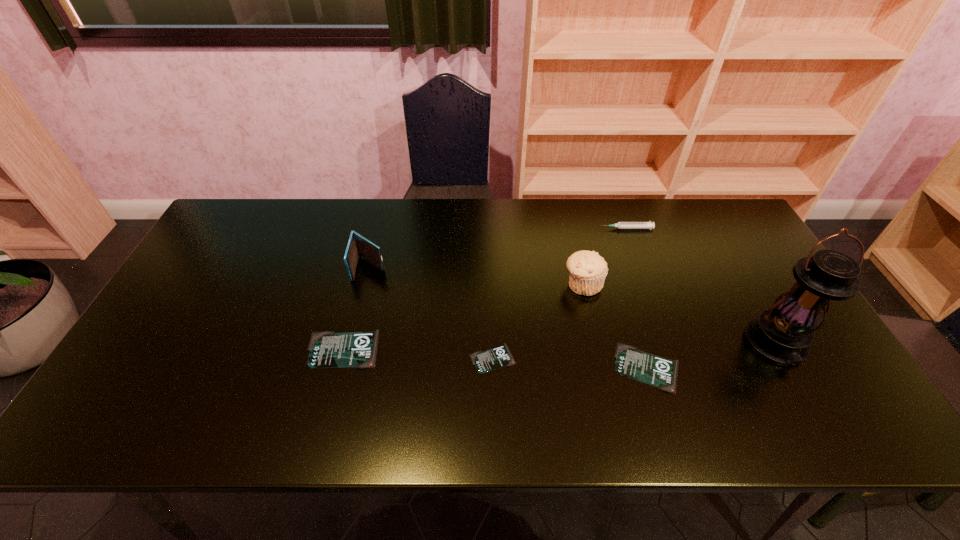
I want to click on the leftmost identity card, so click(x=327, y=349).

I want to click on the second identity card from left to right, so click(485, 361).

Identify the location of the shortest object. Image resolution: width=960 pixels, height=540 pixels. (485, 361).

Where is `the second tallest identity card`? Image resolution: width=960 pixels, height=540 pixels. the second tallest identity card is located at coordinates (644, 367).

Locate an element on the screen. the rightmost identity card is located at coordinates pos(644,367).

Where is `wallet`? This screenshot has height=540, width=960. wallet is located at coordinates click(x=358, y=246).

Locate an element on the screen. The height and width of the screenshot is (540, 960). the fourth shortest object is located at coordinates (620, 225).

Image resolution: width=960 pixels, height=540 pixels. Find the location of `the farthest object`. the farthest object is located at coordinates (620, 225).

Where is `the rightmost object`? The image size is (960, 540). the rightmost object is located at coordinates click(782, 334).

Identify the location of lantern. tap(782, 334).